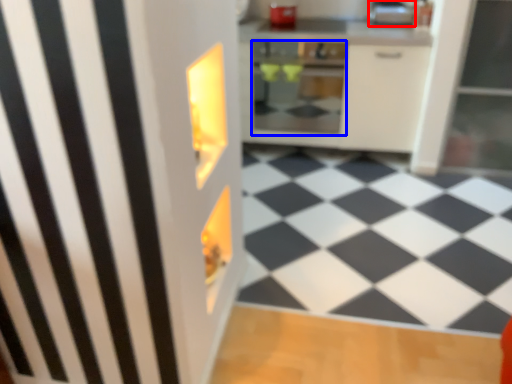
Question: Which of the following is the closest to the observer, appliance (highlighted by a red box) or oven (highlighted by a blue box)?

Choices:
 (A) appliance
 (B) oven

Answer: (B)